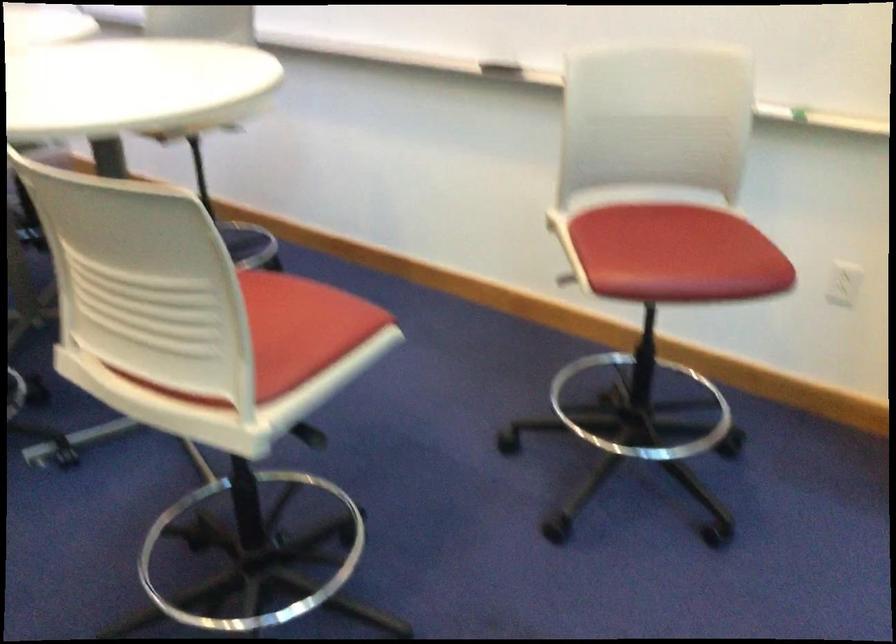
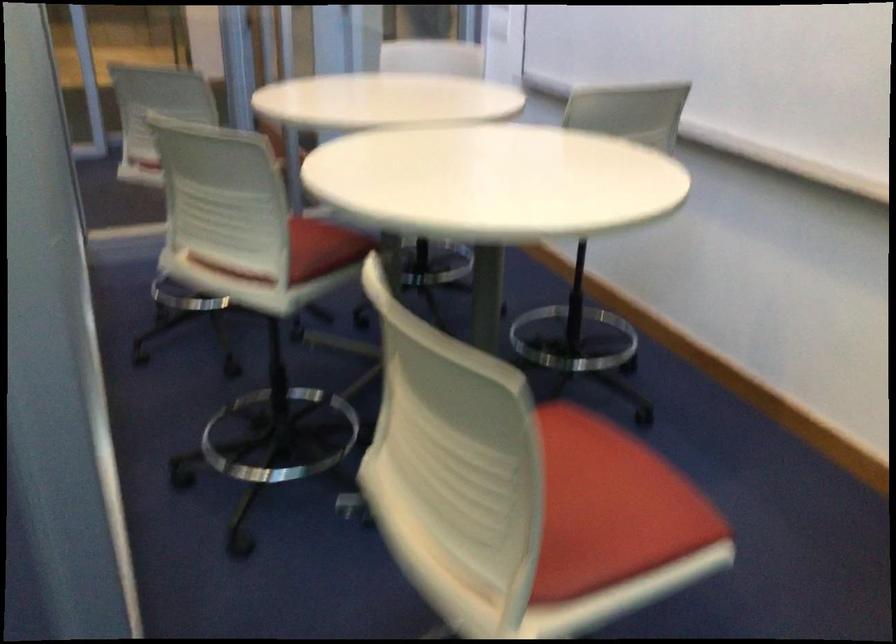
Question: The camera is either moving clockwise (left) or counter-clockwise (right) around the object. The first image is from the beginning of the video and the second image is from the end. Is the camera moving left or right when shooting the video?

Choices:
 (A) Left
 (B) Right

Answer: (B)